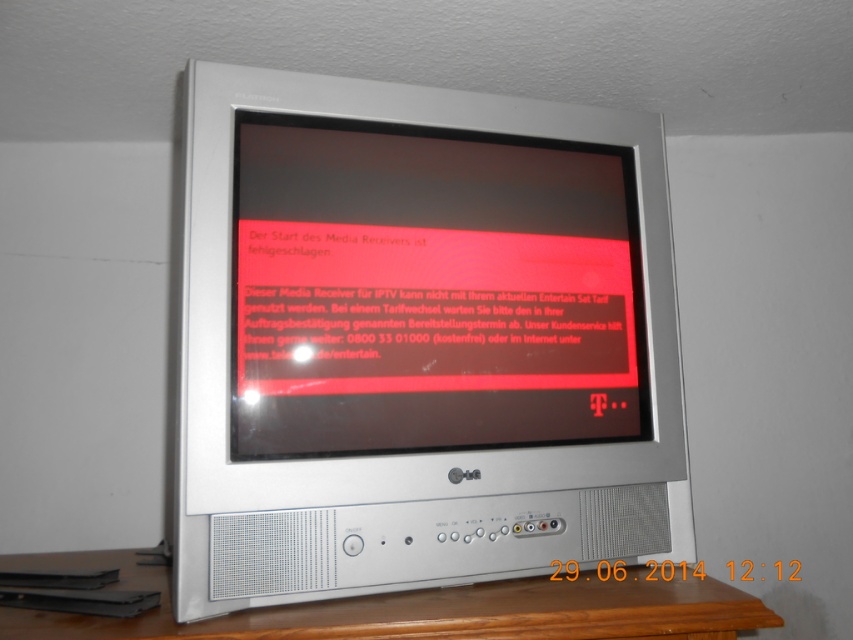
You are setting up a new entertainment system and need to place the silver metallic monitor at center and the matte black screen at center on a shelf. The shelf has limited vertical space. Given their height difference, which object should be placed first to ensure both fit on the shelf?

The silver metallic monitor at center is much taller than the matte black screen at center. To ensure both fit on the shelf with limited vertical space, place the shorter matte black screen at center first, then position the taller silver metallic monitor at center behind or beside it to optimize space usage.

You are a technician inspecting the CRT television. You notice two points on the screen at coordinates point [320,179] and point [381,636]. Which point is closer to the front of the television screen?

Point [381,636] is closer to the front of the television screen because it is closer to the viewer than point [320,179], which is further away.